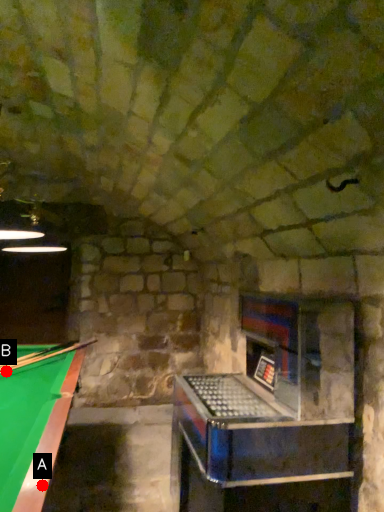
Question: Two points are circled on the image, labeled by A and B beside each circle. Which point is closer to the camera taking this photo?

Choices:
 (A) A is closer
 (B) B is closer

Answer: (A)